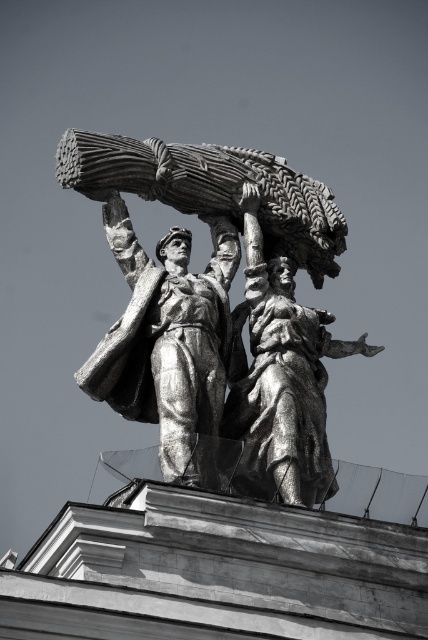
Question: Among these objects, which one is nearest to the camera?

Choices:
 (A) shiny silver statue at center
 (B) bronze statue at center

Answer: (A)

Question: Among these points, which one is farthest from the camera?

Choices:
 (A) (276, 476)
 (B) (213, 280)

Answer: (B)

Question: Can you confirm if bronze statue at center is positioned above shiny silver statue at center?

Choices:
 (A) yes
 (B) no

Answer: (A)

Question: Does bronze statue at center come behind shiny silver statue at center?

Choices:
 (A) no
 (B) yes

Answer: (B)

Question: Is bronze statue at center above shiny silver statue at center?

Choices:
 (A) no
 (B) yes

Answer: (B)